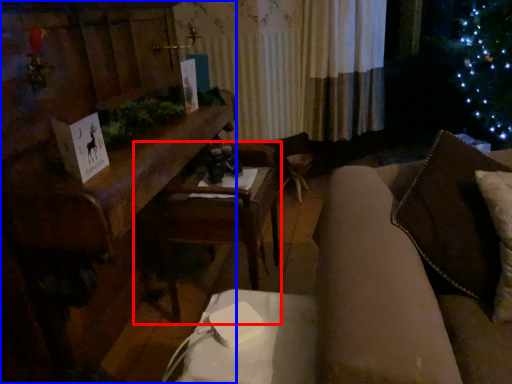
Question: Among these objects, which one is farthest to the camera, armchair (highlighted by a red box) or furniture (highlighted by a blue box)?

Choices:
 (A) armchair
 (B) furniture

Answer: (A)